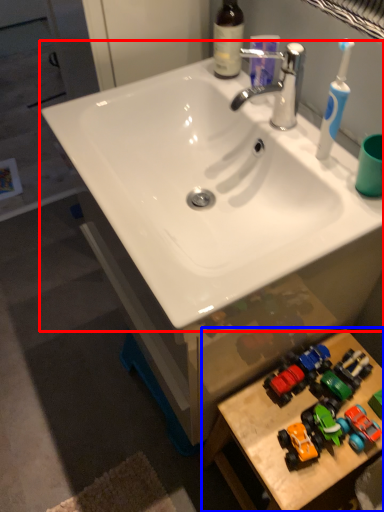
Question: Which object appears closest to the camera in this image, sink (highlighted by a red box) or table (highlighted by a blue box)?

Choices:
 (A) sink
 (B) table

Answer: (A)